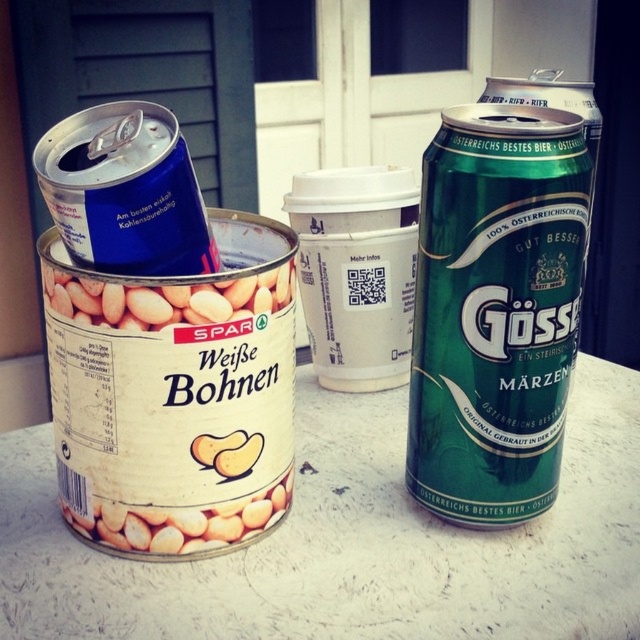
You are organizing items on a table and need to place the blue metallic can at upper left and the white matte beans can at center. According to the scene, which can is located to the left of the other?

The blue metallic can at upper left is positioned on the left side of the white matte beans can at center.

You are a delivery robot that needs to place a new item between the green metallic beer can at right and the blue metallic can at upper left. The item is 9 inches long. Can you fit it between them?

The distance between the green metallic beer can at right and the blue metallic can at upper left is 8.99 inches. Since the item is 9 inches long, it cannot fit between them as the space is slightly smaller than the item.